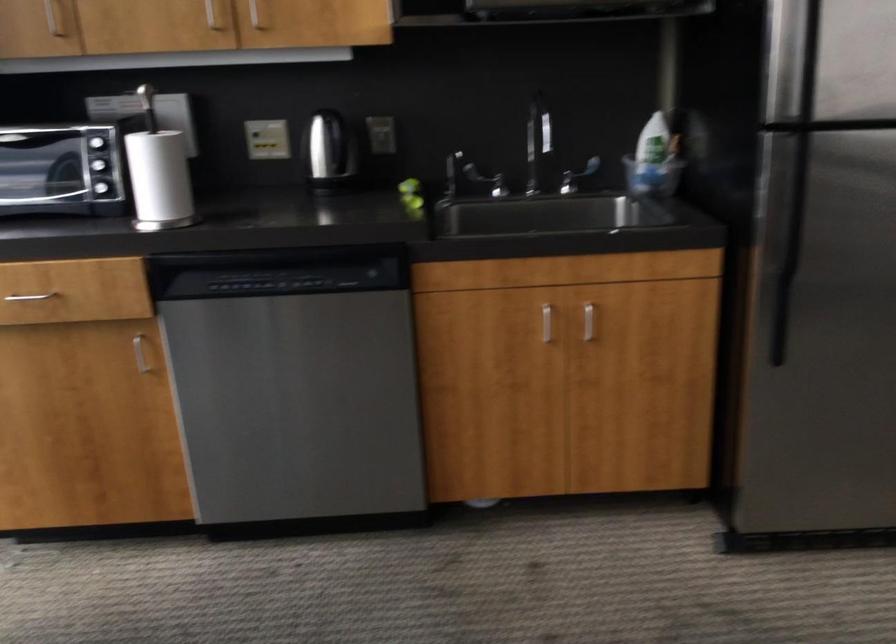
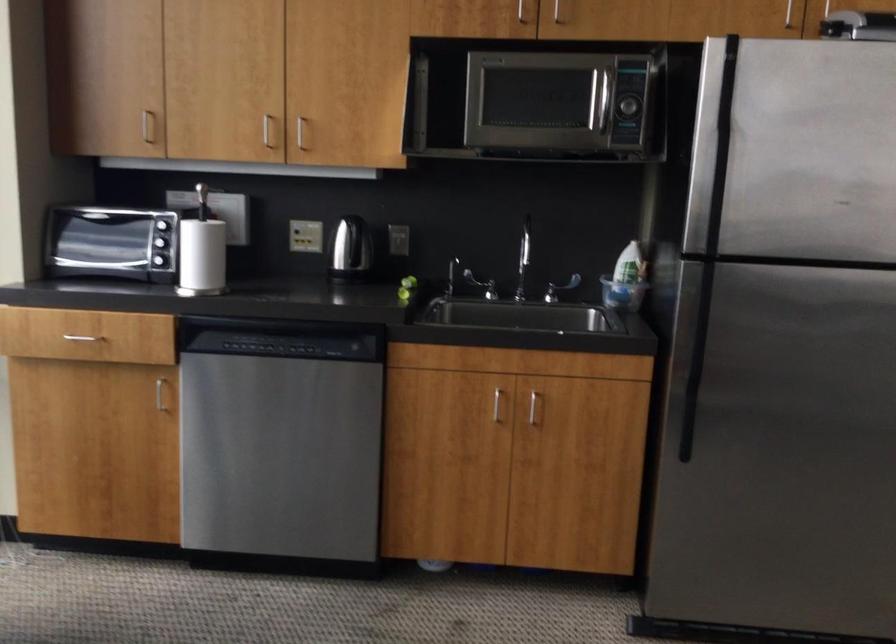
Locate, in the second image, the point that corresponds to point (655, 174) in the first image.

(622, 294)